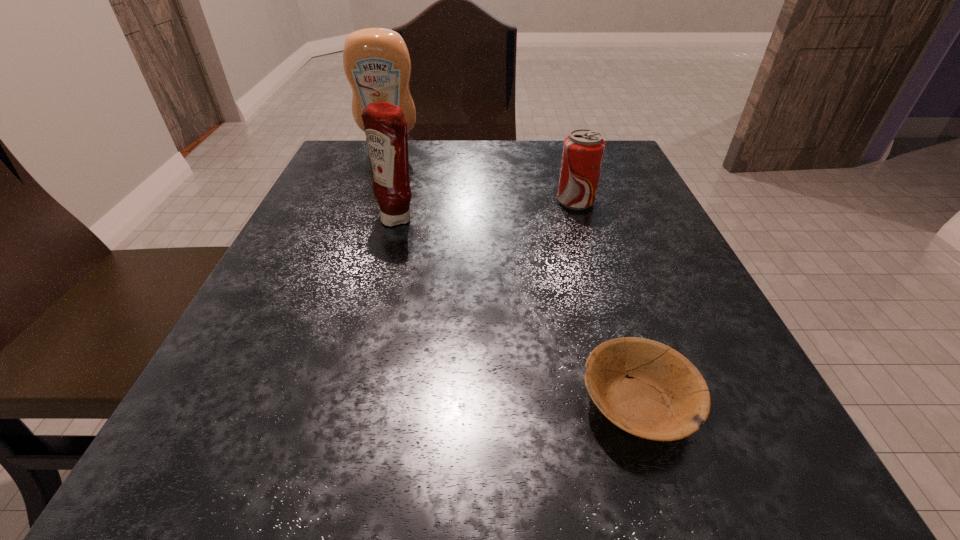
This screenshot has height=540, width=960. What are the coordinates of `empty location between the taller condiment and the soda can` in the screenshot? It's located at (483, 176).

At what (x,y) coordinates should I click in order to perform the action: click on vacant space in between the third shortest object and the nearest object. Please return your answer as a coordinate pair (x, y). This screenshot has width=960, height=540. Looking at the image, I should click on (517, 310).

Identify the location of empty space that is in between the shorter condiment and the second shortest object. (487, 210).

Identify which object is the second closest to the farthest object. Please provide its 2D coordinates. Your answer should be formatted as a tuple, i.e. [(x, y)], where the tuple contains the x and y coordinates of a point satisfying the conditions above.

[(583, 151)]

Find the location of a particular element. object that ranks as the second closest to the third tallest object is located at coordinates (376, 61).

Identify the location of vacant space that satisfies the following two spatial constraints: 1. on the label of the tallest object; 2. on the left side of the soda can. The image size is (960, 540). (372, 202).

Find the location of a particular element. This screenshot has width=960, height=540. vacant position in the image that satisfies the following two spatial constraints: 1. on the label of the farther condiment; 2. on the left side of the nearer condiment is located at coordinates (366, 218).

You are a GUI agent. You are given a task and a screenshot of the screen. Output one action in this format:
    pyautogui.click(x=<x>, y=<y>)
    Task: Click on the vacant area in the image that satisfies the following two spatial constraints: 1. on the label of the farthest object; 2. on the right side of the shortest object
    
    Given the screenshot: What is the action you would take?
    pyautogui.click(x=300, y=403)

At what (x,y) coordinates should I click in order to perform the action: click on free space that satisfies the following two spatial constraints: 1. on the label of the soda can; 2. on the right side of the farthest object. Please return your answer as a coordinate pair (x, y). Looking at the image, I should click on (372, 202).

Identify the location of free space that satisfies the following two spatial constraints: 1. on the label of the tallest object; 2. on the left side of the bowl. This screenshot has width=960, height=540. (300, 403).